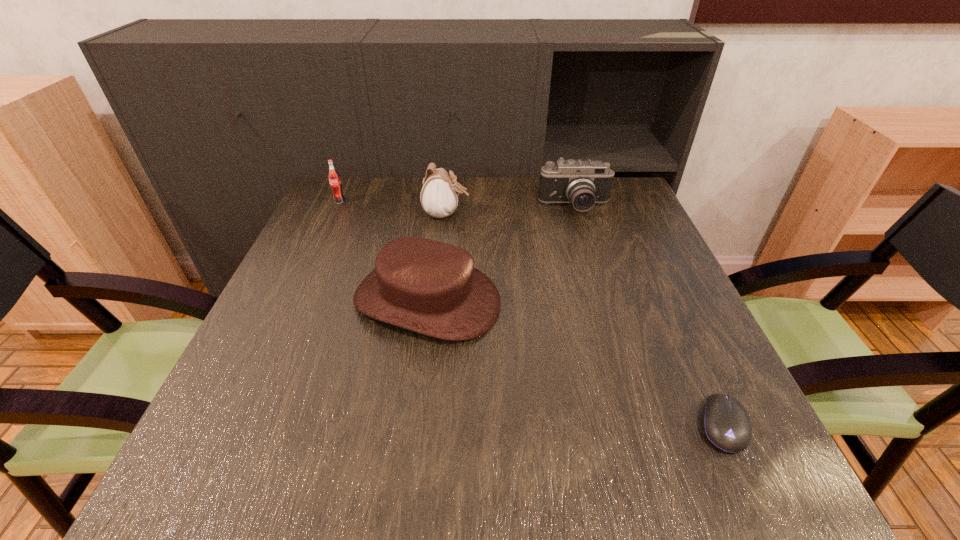
The width and height of the screenshot is (960, 540). I want to click on free spot located 0.060m on the front of the computer mouse, so click(756, 498).

I want to click on pouch present at the far edge, so click(439, 196).

This screenshot has width=960, height=540. I want to click on camera located at the far edge, so click(582, 183).

Locate an element on the screen. soda bottle that is positioned at the far edge is located at coordinates (334, 179).

Find the location of `object that is positioned at the near edge`. object that is positioned at the near edge is located at coordinates (726, 424).

At what (x,y) coordinates should I click in order to perform the action: click on object that is at the left edge. Please return your answer as a coordinate pair (x, y). This screenshot has height=540, width=960. Looking at the image, I should click on (334, 179).

The image size is (960, 540). In order to click on camera situated at the right edge in this screenshot , I will do click(x=582, y=183).

Locate an element on the screen. computer mouse at the right edge is located at coordinates click(x=726, y=424).

Where is `object at the far left corner`? This screenshot has height=540, width=960. object at the far left corner is located at coordinates (334, 179).

You are a GUI agent. You are given a task and a screenshot of the screen. Output one action in this format:
    pyautogui.click(x=<x>, y=<y>)
    Task: Click on the object present at the far right corner
    
    Given the screenshot: What is the action you would take?
    pyautogui.click(x=582, y=183)